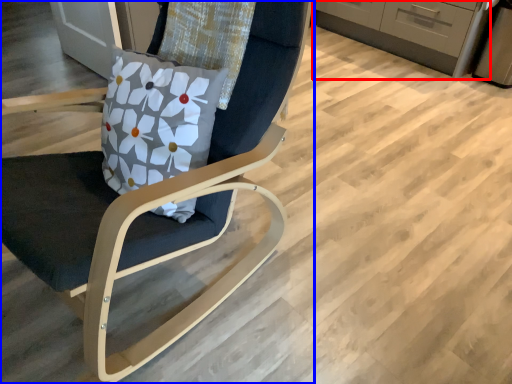
Question: Which object appears farthest to the camera in this image, cabinetry (highlighted by a red box) or chair (highlighted by a blue box)?

Choices:
 (A) cabinetry
 (B) chair

Answer: (A)